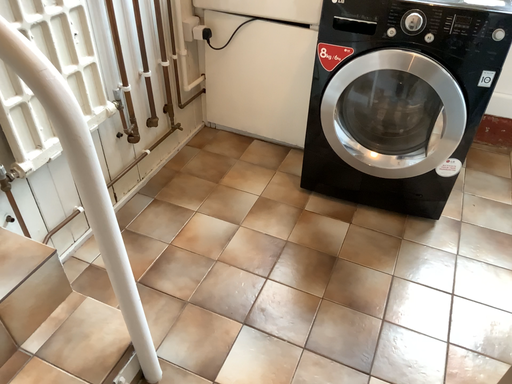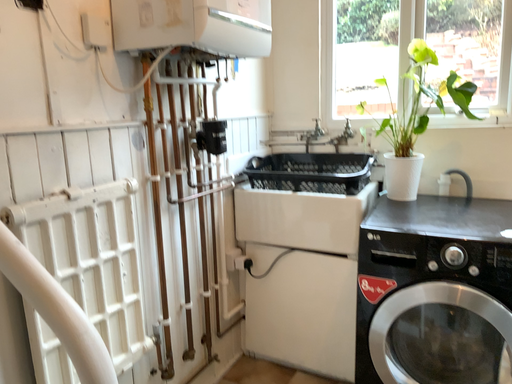
Question: Which way did the camera rotate in the video?

Choices:
 (A) rotated downward
 (B) rotated upward

Answer: (B)